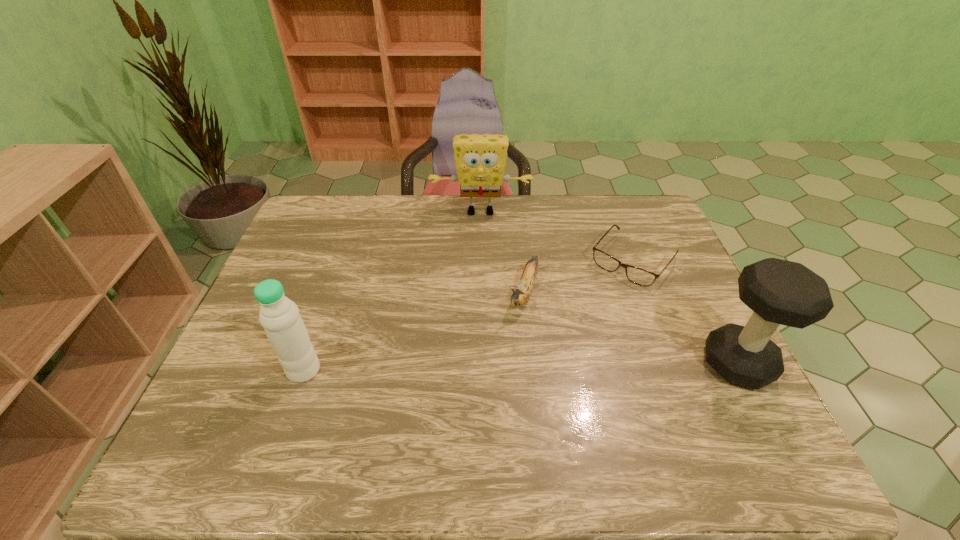
Where is `the leftmost object`? the leftmost object is located at coordinates (279, 316).

Find the location of a particular element. The height and width of the screenshot is (540, 960). dumbbell is located at coordinates (782, 292).

I want to click on spectacles, so click(x=639, y=276).

Image resolution: width=960 pixels, height=540 pixels. Identify the location of the farthest object. (480, 160).

Locate an element on the screen. the fourth tallest object is located at coordinates click(x=520, y=296).

Identify the location of vacant space situated 0.380m on the back of the water bottle. (344, 255).

Image resolution: width=960 pixels, height=540 pixels. What are the coordinates of `vacant space located on the left of the dumbbell` in the screenshot? It's located at (573, 363).

The image size is (960, 540). I want to click on free space located 0.260m on the lenses of the shortest object, so click(x=567, y=340).

The width and height of the screenshot is (960, 540). I want to click on vacant space located 0.050m on the lenses of the shortest object, so click(606, 293).

Identify the location of vacant space located 0.220m on the lenses of the shortest object. This screenshot has height=540, width=960. (576, 330).